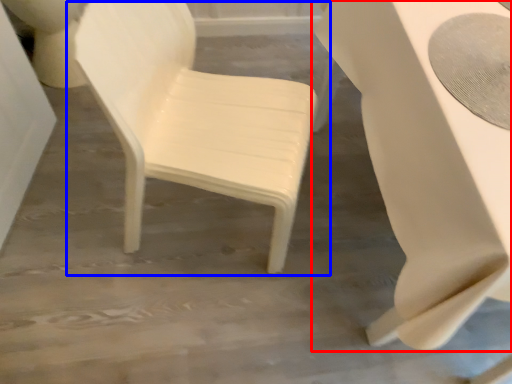
Question: Among these objects, which one is farthest to the camera, table (highlighted by a red box) or chair (highlighted by a blue box)?

Choices:
 (A) table
 (B) chair

Answer: (B)